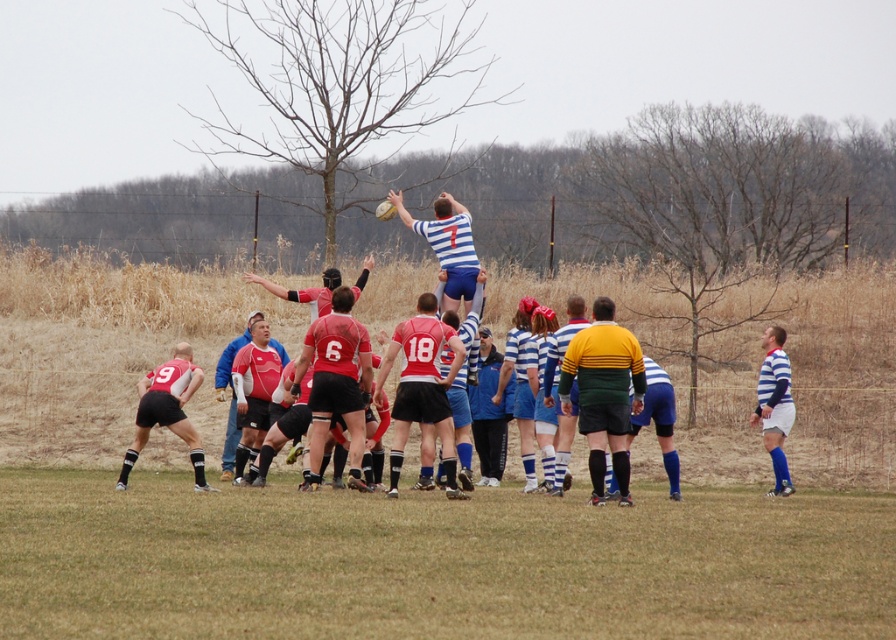
Question: Which point appears farthest from the camera in this image?

Choices:
 (A) (765, 433)
 (B) (158, 365)

Answer: (B)

Question: In this image, where is matte red jersey at lower left located relative to striped jersey at center?

Choices:
 (A) above
 (B) below

Answer: (B)

Question: Which point is closer to the camera?

Choices:
 (A) matte red jersey at lower left
 (B) striped jersey at right

Answer: (A)

Question: Does yellow-green striped jersey at center appear on the left side of striped jersey at right?

Choices:
 (A) no
 (B) yes

Answer: (B)

Question: Which point appears closest to the camera in this image?

Choices:
 (A) (452, 280)
 (B) (600, 396)
 (C) (769, 444)
 (D) (157, 413)

Answer: (B)

Question: Can you confirm if striped jersey at center is positioned to the right of striped jersey at right?

Choices:
 (A) yes
 (B) no

Answer: (B)